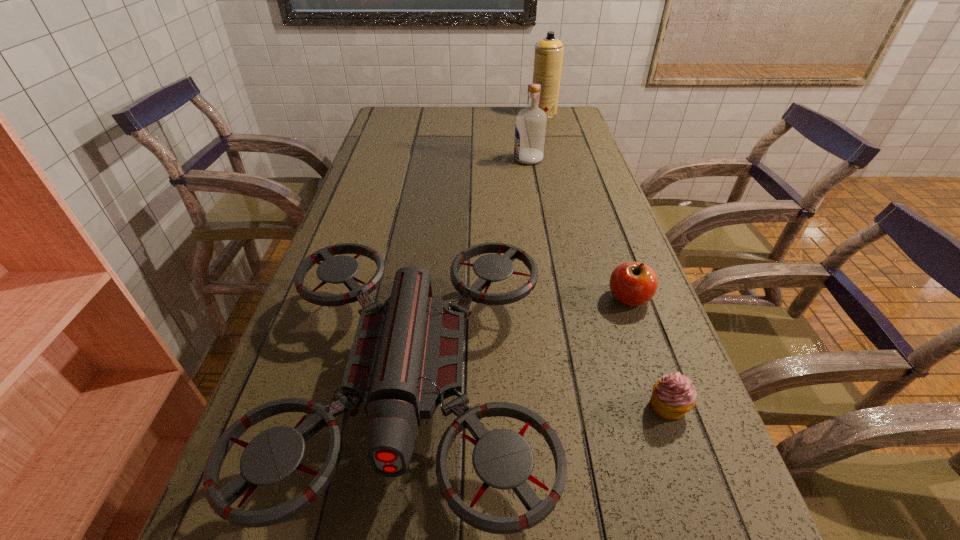
Where is `vacant point that satisfies the following two spatial constraints: 1. on the label of the cupcake; 2. on the left side of the second farthest object`? The width and height of the screenshot is (960, 540). vacant point that satisfies the following two spatial constraints: 1. on the label of the cupcake; 2. on the left side of the second farthest object is located at coordinates (571, 406).

Where is `blank area in the image that satisfies the following two spatial constraints: 1. on the label of the vodka; 2. on the back side of the apple`? Image resolution: width=960 pixels, height=540 pixels. blank area in the image that satisfies the following two spatial constraints: 1. on the label of the vodka; 2. on the back side of the apple is located at coordinates (552, 298).